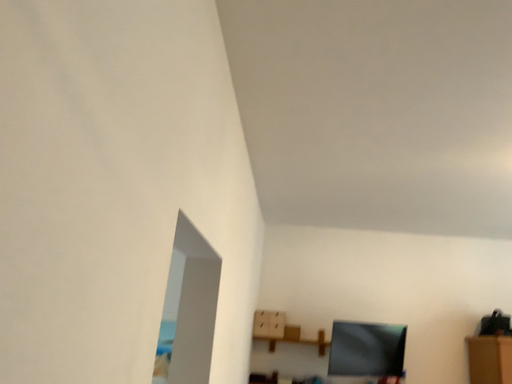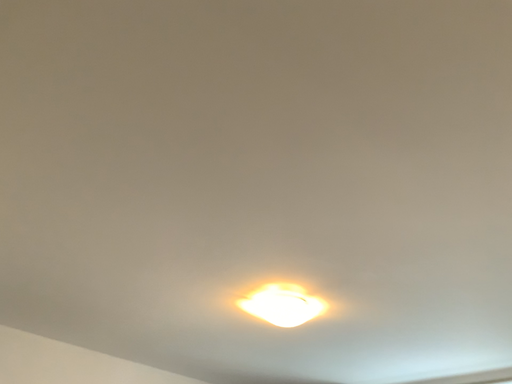
Question: How did the camera likely rotate when shooting the video?

Choices:
 (A) rotated left
 (B) rotated right

Answer: (B)